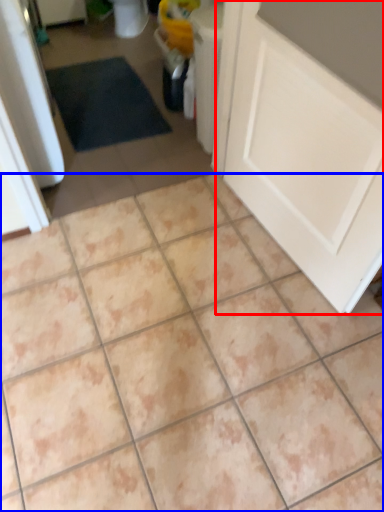
Question: Which object is further to the camera taking this photo, door (highlighted by a red box) or ceramic tile (highlighted by a blue box)?

Choices:
 (A) door
 (B) ceramic tile

Answer: (B)